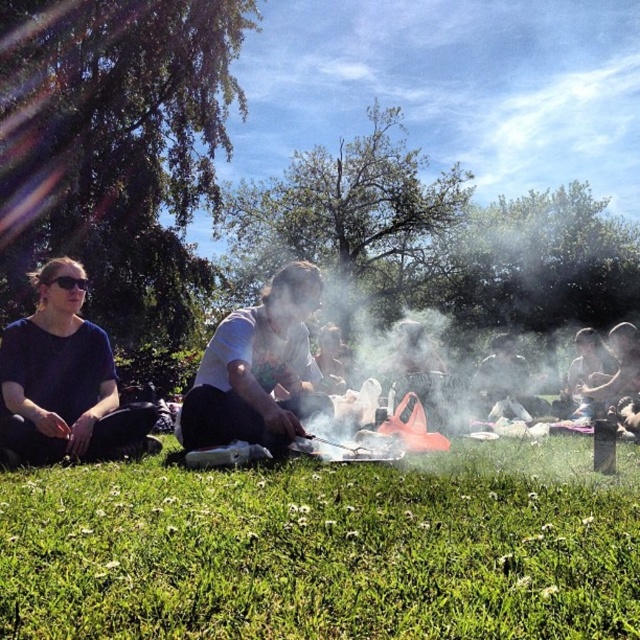
You are standing at the camera position and want to place a 3 feet long picnic blanket on the green grass at lower center. Will the entire blanket fit on the grass without overlapping any other objects?

The green grass at lower center is 4.68 feet away from the camera. Since the picnic blanket is 3 feet long, it can be placed entirely on the grass without overlapping other objects as there is sufficient space available.

You are standing at the edge of the scene looking towards the center. You see the green grass at lower center and the white matte grill at center. Which object is positioned more to the right?

The green grass at lower center is positioned to the right of the white matte grill at center, so it is more to the right.

You are standing at the edge of the scene and want to walk towards the green grass at lower center. Which direction should you walk relative to the matte black shirt at left?

The green grass at lower center is in front of the matte black shirt at left, so you should walk towards the direction of the matte black shirt at left to reach the green grass at lower center.